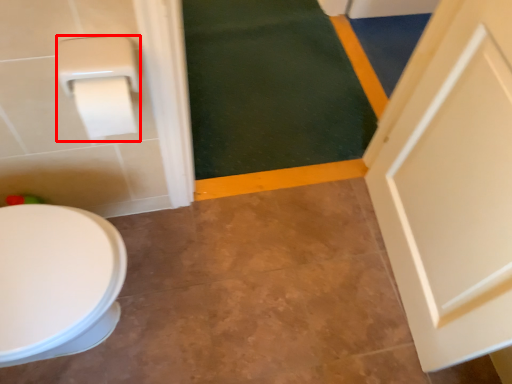
Question: From the image's perspective, what is the correct spatial relationship of toilet paper (annotated by the red box) in relation to bath mat?

Choices:
 (A) below
 (B) above

Answer: (A)